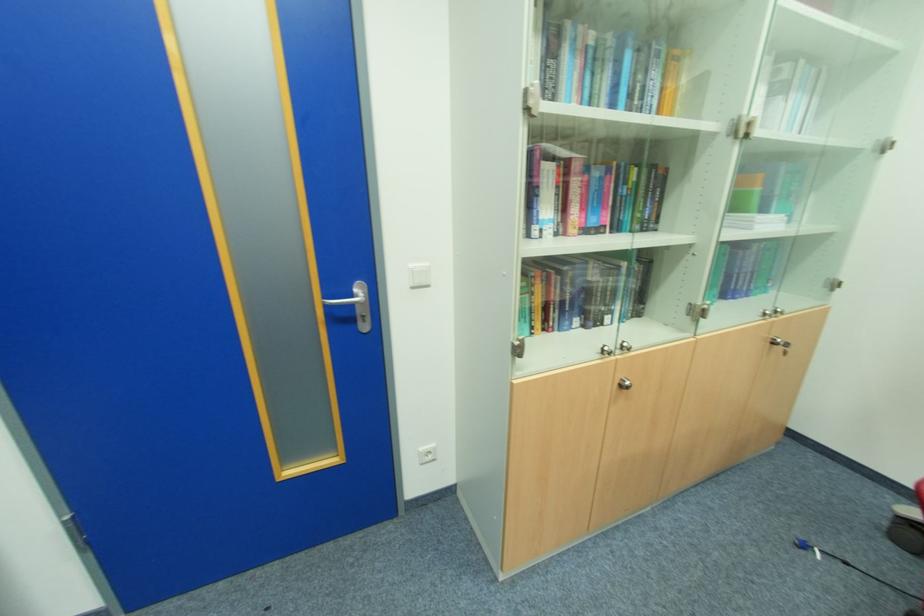
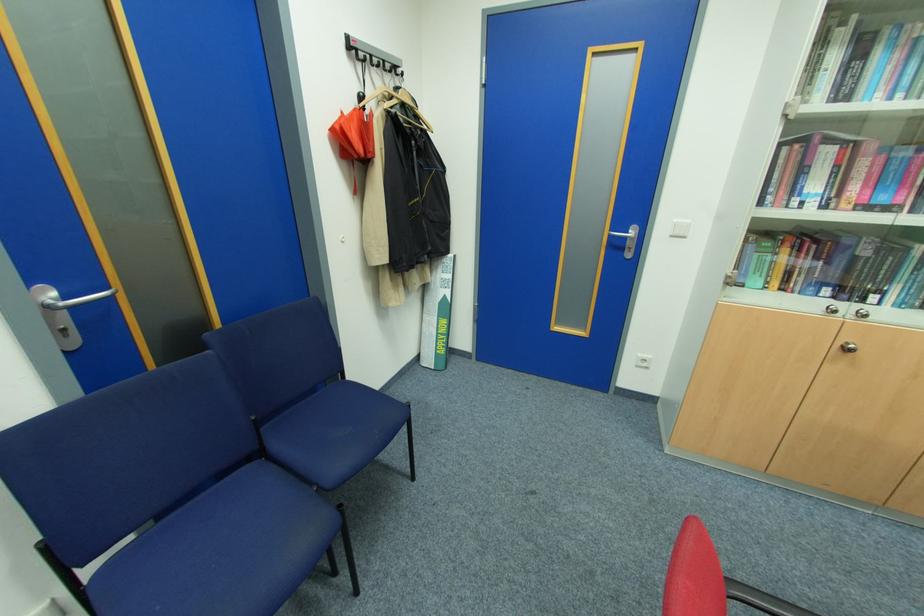
The point at (x=357, y=294) is marked in the first image. Where is the corresponding point in the second image?

(630, 233)